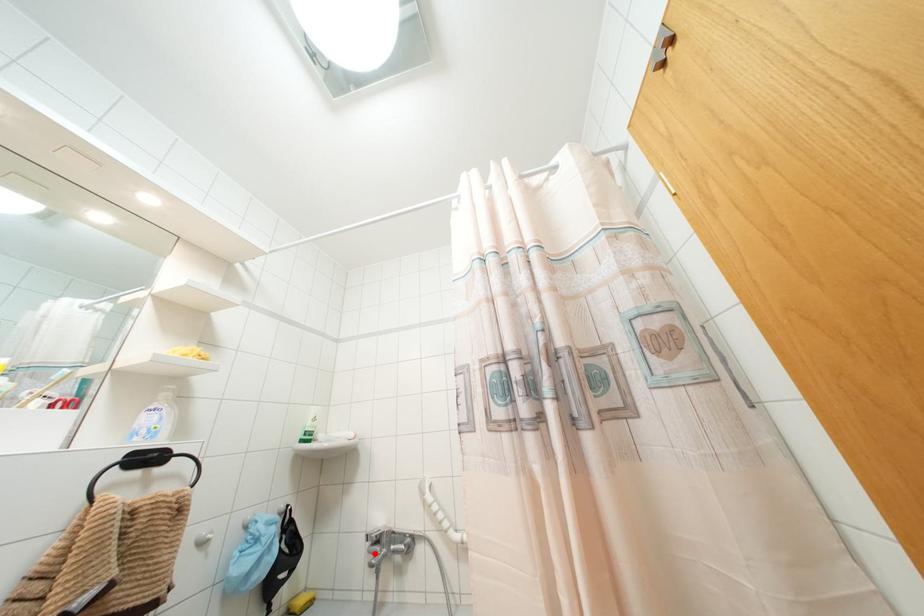
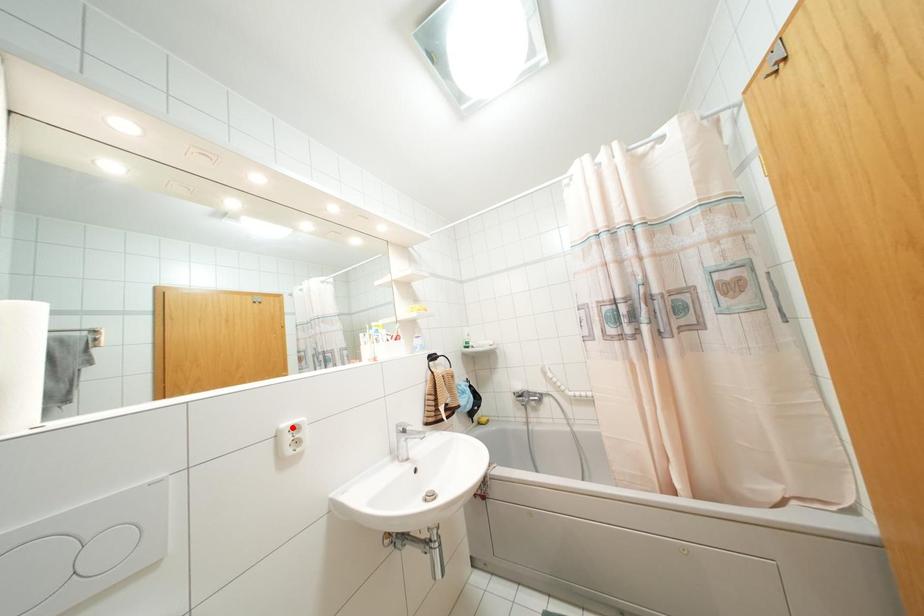
I am providing you with two images of the same scene from different viewpoints. A red point is marked on the first image and another point is marked on the second image. Is the red point in image1 aligned with the point shown in image2?

No